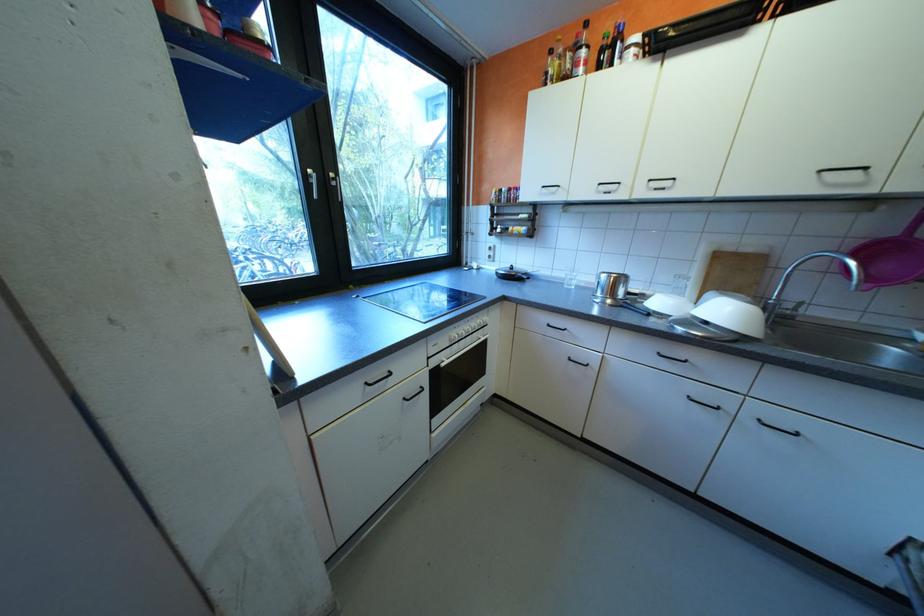
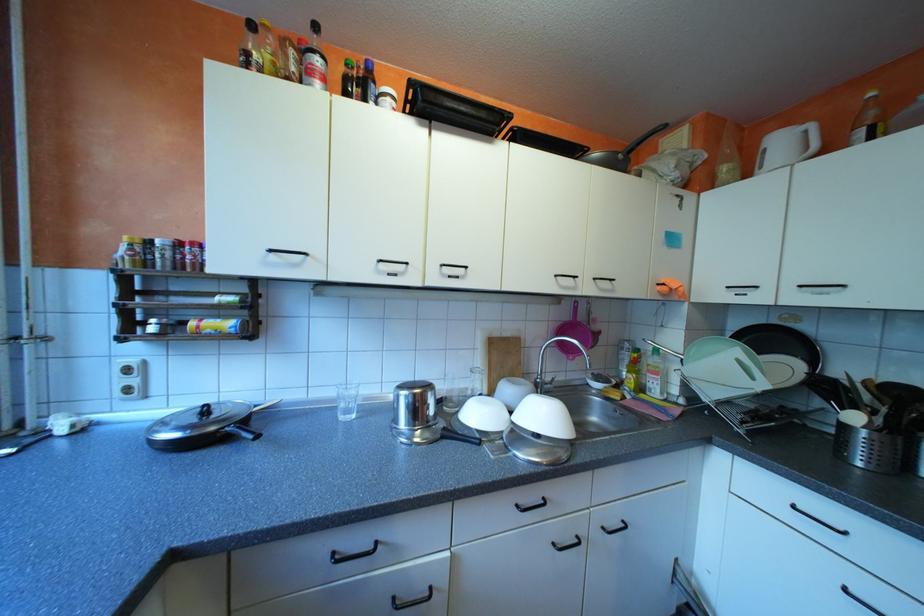
Question: The camera is either moving clockwise (left) or counter-clockwise (right) around the object. The first image is from the beginning of the video and the second image is from the end. Is the camera moving left or right when shooting the video?

Choices:
 (A) Left
 (B) Right

Answer: (A)